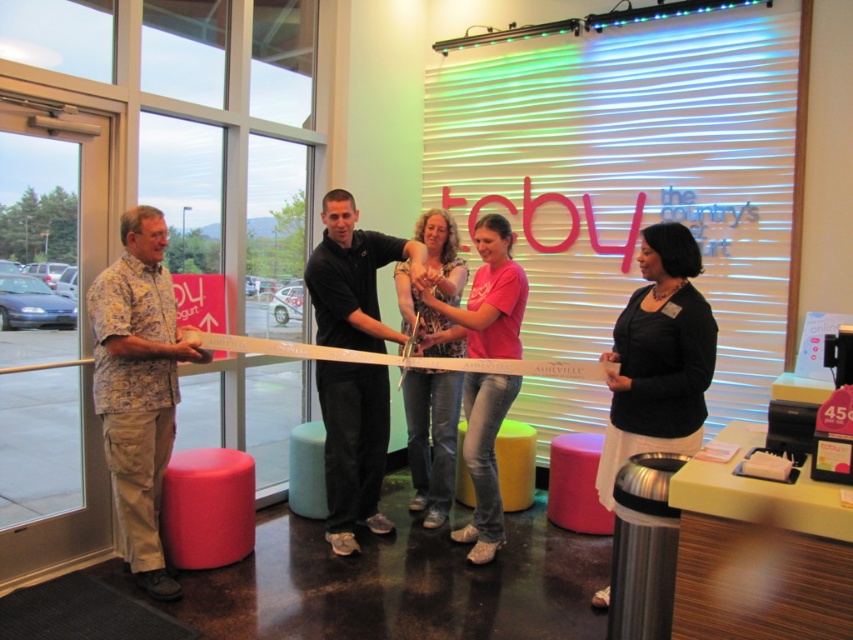
Who is positioned more to the left, hawaiian print shirt at left or printed cotton blouse at center?

Positioned to the left is hawaiian print shirt at left.

Is hawaiian print shirt at left above printed cotton blouse at center?

No.

Who is more forward, (109,280) or (445,477)?

Point (109,280) is in front.

At what (x,y) coordinates should I click in order to perform the action: click on hawaiian print shirt at left. Please return your answer as a coordinate pair (x, y). The image size is (853, 640). Looking at the image, I should click on (138, 387).

Is point (480, 541) less distant than point (426, 324)?

Yes, it is in front of point (426, 324).

Locate an element on the screen. This screenshot has height=640, width=853. pink cotton shirt at center is located at coordinates (486, 298).

What do you see at coordinates (486, 298) in the screenshot?
I see `pink cotton shirt at center` at bounding box center [486, 298].

Locate an element on the screen. This screenshot has width=853, height=640. pink cotton shirt at center is located at coordinates (486, 298).

Does black matte jacket at center have a greater height compared to teal fabric stool at center?

Correct, black matte jacket at center is much taller as teal fabric stool at center.

Is black matte jacket at center below teal fabric stool at center?

No, black matte jacket at center is not below teal fabric stool at center.

Does point (662, 433) come in front of point (321, 481)?

Yes, it is in front of point (321, 481).

This screenshot has height=640, width=853. Identify the location of black matte jacket at center. (659, 356).